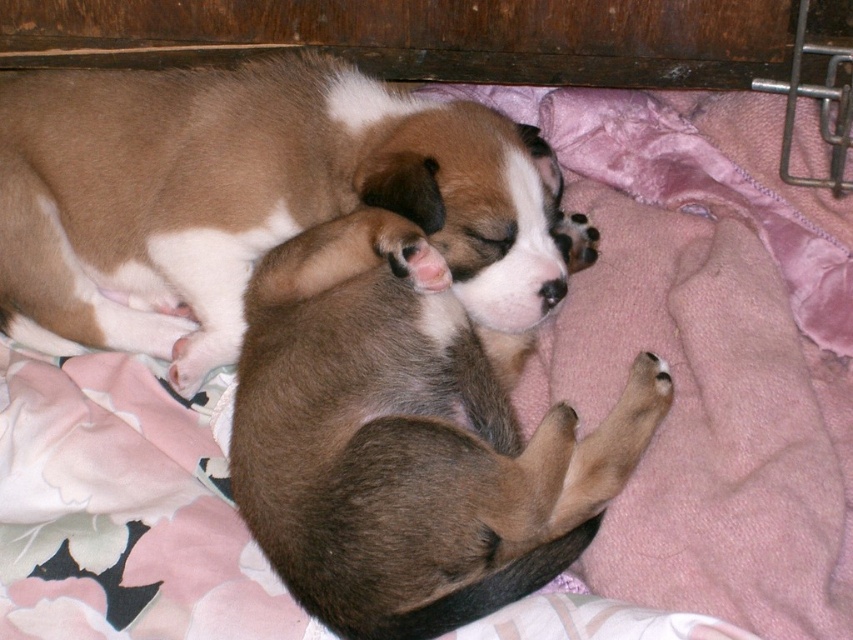
You are a veterinarian examining two puppies lying on a pink blanket. The puppies are the brown fur dog at center and the brown furry dog at center. How far apart are these two puppies from each other?

Answer: The brown fur dog at center is 6.95 inches from brown furry dog at center.

You are a veterinarian observing two puppies on a pink blanket. You notice the brown fur dog at center and the brown furry dog at center. Which puppy is positioned higher in the image?

The brown fur dog at center is positioned higher than the brown furry dog at center in the image.